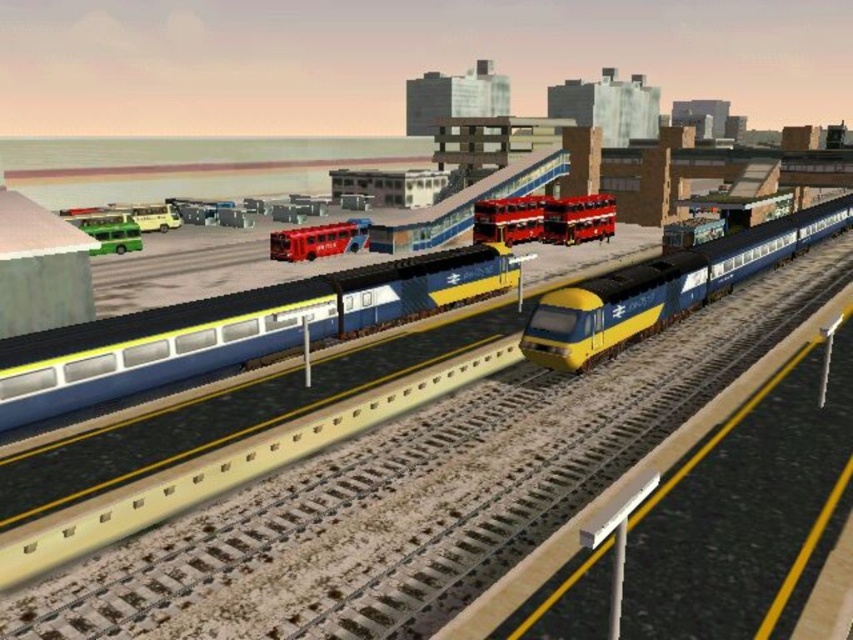
Question: Based on their relative distances, which object is farther from the red metallic bus at center?

Choices:
 (A) blue glossy train at center
 (B) metallic red bus at center
 (C) yellow matte passenger train at center

Answer: (A)

Question: Which object appears farthest from the camera in this image?

Choices:
 (A) yellow matte passenger train at center
 (B) metallic red bus at center
 (C) blue glossy train at center

Answer: (B)

Question: Considering the relative positions of blue glossy train at center and metallic red bus at center in the image provided, where is blue glossy train at center located with respect to metallic red bus at center?

Choices:
 (A) below
 (B) above

Answer: (A)

Question: Is blue glossy train at center behind red metallic bus at center?

Choices:
 (A) no
 (B) yes

Answer: (A)

Question: Is yellow matte passenger train at center above metallic red bus at center?

Choices:
 (A) yes
 (B) no

Answer: (B)

Question: Which point appears closest to the camera in this image?

Choices:
 (A) (611, 204)
 (B) (41, 362)

Answer: (B)